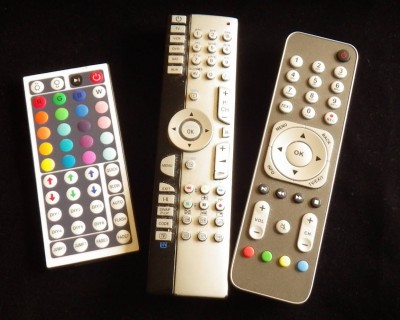
You are a GUI agent. You are given a task and a screenshot of the screen. Output one action in this format:
    pyautogui.click(x=<x>, y=<y>)
    Task: Click on the silver remote
    The width and height of the screenshot is (400, 320).
    Given the screenshot: What is the action you would take?
    pyautogui.click(x=75, y=258)